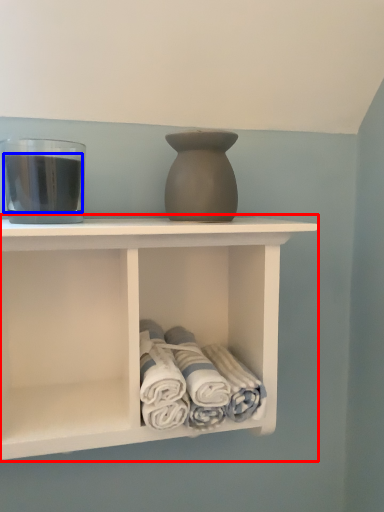
Question: Which of the following is the farthest to the observer, shelf (highlighted by a red box) or beverage (highlighted by a blue box)?

Choices:
 (A) shelf
 (B) beverage

Answer: (B)